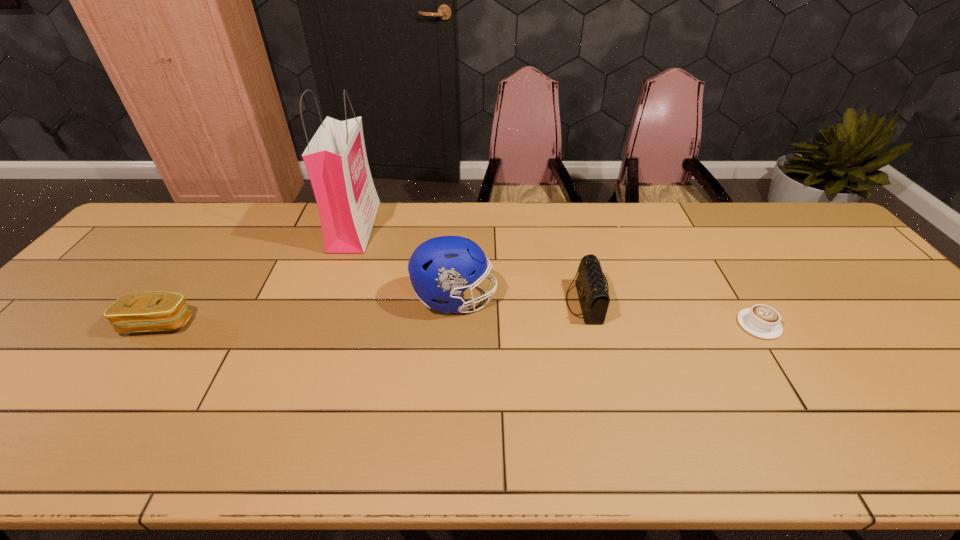
Where is `vacant position located 0.370m on the front-facing side of the tallest object`? The width and height of the screenshot is (960, 540). vacant position located 0.370m on the front-facing side of the tallest object is located at coordinates (487, 226).

Locate an element on the screen. vacant area situated on the face guard of the fourth shortest object is located at coordinates (556, 299).

Locate an element on the screen. vacant region located on the front flap of the fourth object from left to right is located at coordinates (420, 303).

Locate an element on the screen. This screenshot has height=540, width=960. vacant space located on the front flap of the fourth object from left to right is located at coordinates (517, 303).

What are the coordinates of `blank space located on the front flap of the fourth object from left to right` in the screenshot? It's located at (488, 303).

Find the location of `vacant space positioned 0.100m on the zipper side of the second shortest object`. vacant space positioned 0.100m on the zipper side of the second shortest object is located at coordinates (124, 373).

This screenshot has height=540, width=960. In order to click on vacant space located 0.120m with the handle on the right side of the shortest object in this screenshot , I will do `click(827, 325)`.

Locate an element on the screen. The image size is (960, 540). object that is positioned at the far edge is located at coordinates (336, 161).

Identify the location of vacant space at the far edge of the desktop. This screenshot has width=960, height=540. 612,238.

In the image, there is a desktop. Identify the location of vacant space at the near edge. The width and height of the screenshot is (960, 540). (340, 452).